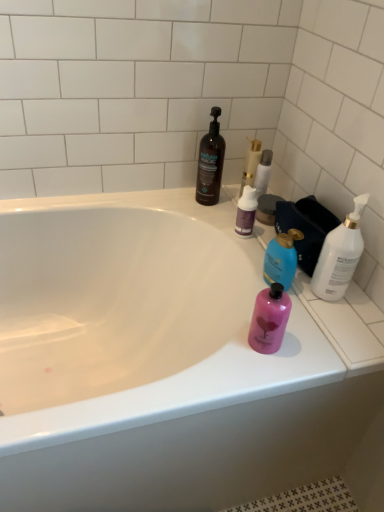
Question: Is white glossy bathtub at upper center thinner than pink matte bottle at right, marked as the third bottle in a left-to-right arrangement?

Choices:
 (A) no
 (B) yes

Answer: (A)

Question: Is white glossy bathtub at upper center positioned behind pink matte bottle at right, marked as the third bottle in a left-to-right arrangement?

Choices:
 (A) yes
 (B) no

Answer: (B)

Question: From the image's perspective, would you say white glossy bathtub at upper center is shown under pink matte bottle at right, positioned as the third bottle in right-to-left order?

Choices:
 (A) yes
 (B) no

Answer: (A)

Question: Is white glossy bathtub at upper center to the right of pink matte bottle at right, marked as the third bottle in a left-to-right arrangement, from the viewer's perspective?

Choices:
 (A) no
 (B) yes

Answer: (A)

Question: Is pink matte bottle at right, marked as the third bottle in a left-to-right arrangement, a part of white glossy bathtub at upper center?

Choices:
 (A) yes
 (B) no

Answer: (B)

Question: Is point (208, 162) positioned closer to the camera than point (248, 198)?

Choices:
 (A) farther
 (B) closer

Answer: (A)

Question: From the image's perspective, is dark brown plastic bottle at upper center, arranged as the 5th bottle when viewed from the right, positioned above or below purple matte bottle at upper center, the second bottle when ordered from left to right?

Choices:
 (A) below
 (B) above

Answer: (B)

Question: Would you say dark brown plastic bottle at upper center, arranged as the 5th bottle when viewed from the right, is inside or outside purple matte bottle at upper center, the second bottle when ordered from left to right?

Choices:
 (A) inside
 (B) outside

Answer: (B)

Question: From their relative heights in the image, would you say dark brown plastic bottle at upper center, arranged as the first bottle when viewed from the left, is taller or shorter than purple matte bottle at upper center, the fourth bottle in the right-to-left sequence?

Choices:
 (A) tall
 (B) short

Answer: (A)

Question: Is white glossy bathtub at upper center spatially inside gold metallic candle at upper center, or outside of it?

Choices:
 (A) inside
 (B) outside

Answer: (B)

Question: Is white glossy bathtub at upper center bigger or smaller than gold metallic candle at upper center?

Choices:
 (A) small
 (B) big

Answer: (B)

Question: Is white glossy bathtub at upper center taller or shorter than gold metallic candle at upper center?

Choices:
 (A) tall
 (B) short

Answer: (A)

Question: Considering their positions, is white glossy bathtub at upper center located in front of or behind gold metallic candle at upper center?

Choices:
 (A) front
 (B) behind

Answer: (A)

Question: Is white glossy bottle at right, the 1th bottle in the right-to-left sequence, situated inside purple matte bottle at upper center, the fourth bottle in the right-to-left sequence, or outside?

Choices:
 (A) outside
 (B) inside

Answer: (A)

Question: Based on their sizes in the image, would you say white glossy bottle at right, the 1th bottle in the right-to-left sequence, is bigger or smaller than purple matte bottle at upper center, the second bottle when ordered from left to right?

Choices:
 (A) big
 (B) small

Answer: (A)